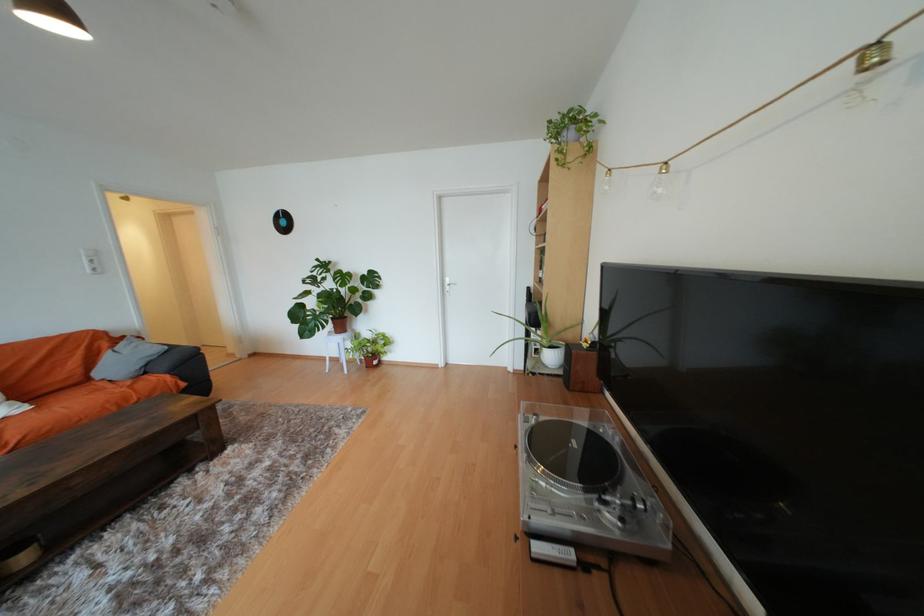
You are a GUI agent. You are given a task and a screenshot of the screen. Output one action in this format:
    pyautogui.click(x=<x>, y=<y>)
    Task: Click on the white light switch
    The image size is (924, 616).
    Given the screenshot: What is the action you would take?
    (91, 261)